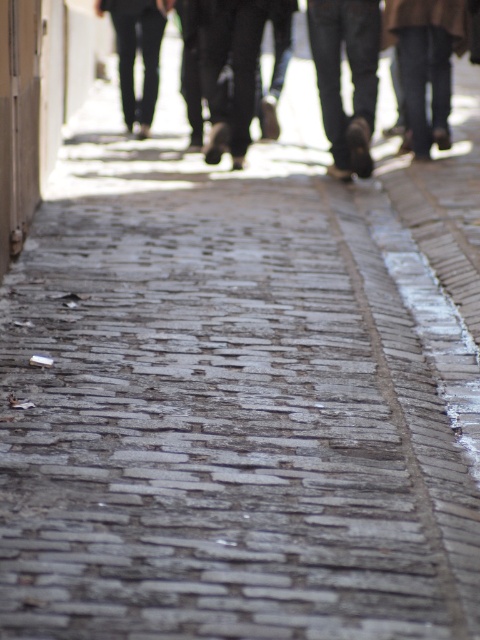
You are a photographer standing on the cobblestone pavement and see the brown leather shoes at upper center and the dark gray pants at center. Which object is closer to you?

The brown leather shoes at upper center is closer to you because it is in front of the dark gray pants at center.

You are standing on the cobblestone pavement and see a point marked at coordinates (350, 74). What object is located at that point?

The brown leather shoes at upper center is located at point (350, 74).

Consider the image. You are a photographer standing on the cobblestone pavement. You want to take a photo of the brown leather shoes at upper center and dark brown leather shoes at upper right. If your camera can only focus on objects within 5 feet of each other, will both shoes be in focus?

The brown leather shoes at upper center is 6.04 feet from dark brown leather shoes at upper right. Since the distance exceeds the camera focus range of 5 feet, both shoes cannot be in focus simultaneously.